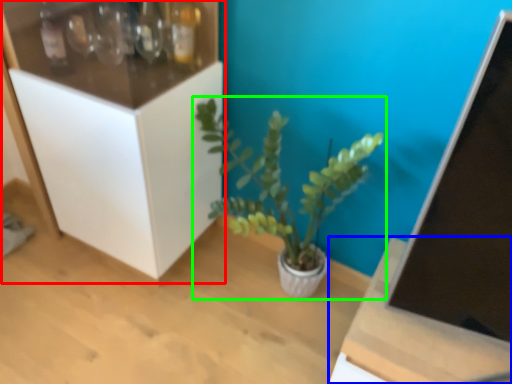
Question: Which object is positioned closest to cabinetry (highlighted by a red box)? Select from table (highlighted by a blue box) and houseplant (highlighted by a green box).

Choices:
 (A) table
 (B) houseplant

Answer: (B)